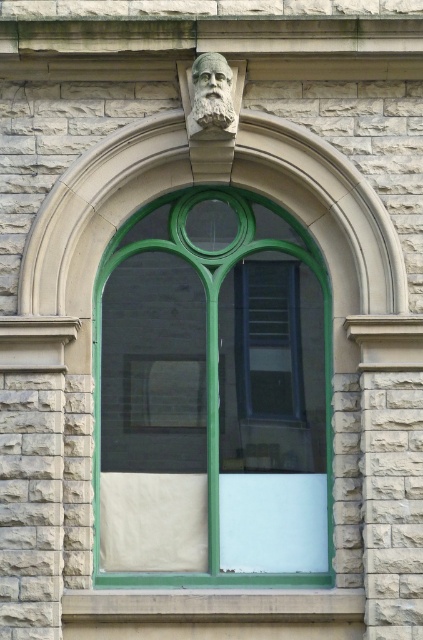
Question: Which of the following is the farthest from the observer?

Choices:
 (A) stone carved bust at upper center
 (B) smooth concrete window sill at center
 (C) green glass window at center

Answer: (C)

Question: Which object is positioned farthest from the stone carved bust at upper center?

Choices:
 (A) white stone face at upper center
 (B) smooth concrete window sill at center
 (C) green glass window at center

Answer: (B)

Question: Among these objects, which one is nearest to the camera?

Choices:
 (A) white stone face at upper center
 (B) stone carved bust at upper center
 (C) green glass window at center
 (D) smooth concrete window sill at center

Answer: (D)

Question: Does green glass window at center have a greater width compared to smooth concrete window sill at center?

Choices:
 (A) no
 (B) yes

Answer: (A)

Question: Can you confirm if green glass window at center is bigger than white stone face at upper center?

Choices:
 (A) no
 (B) yes

Answer: (B)

Question: Considering the relative positions of green glass window at center and white stone face at upper center in the image provided, where is green glass window at center located with respect to white stone face at upper center?

Choices:
 (A) right
 (B) left

Answer: (A)